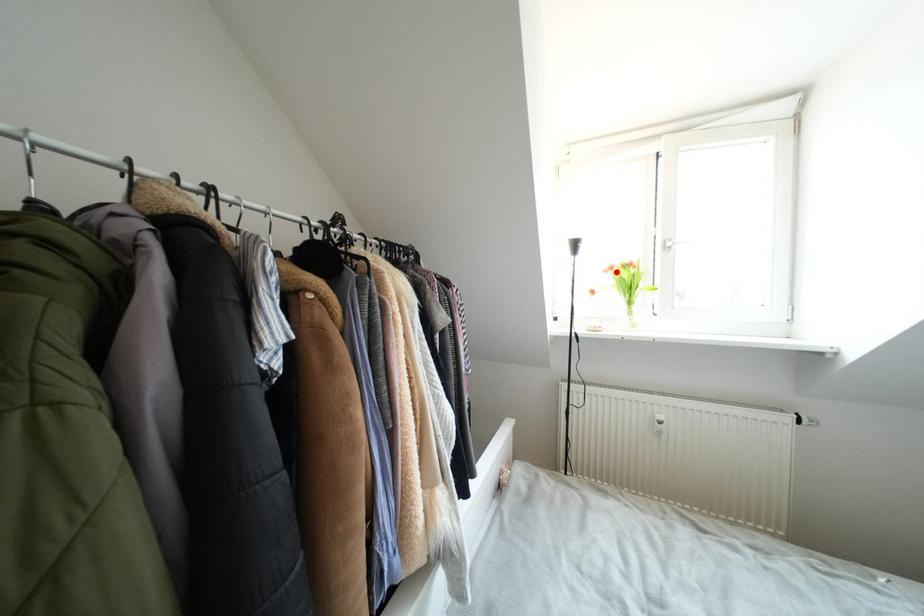
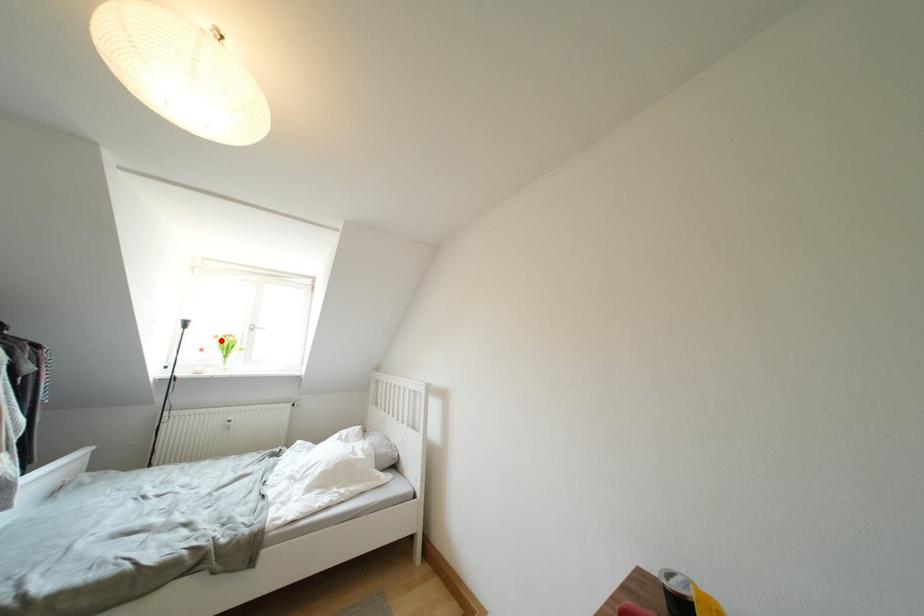
I am providing you with two images of the same scene from different viewpoints. A red point is marked on the first image and another point is marked on the second image. Is the marked point in image1 the same physical position as the marked point in image2?

Yes